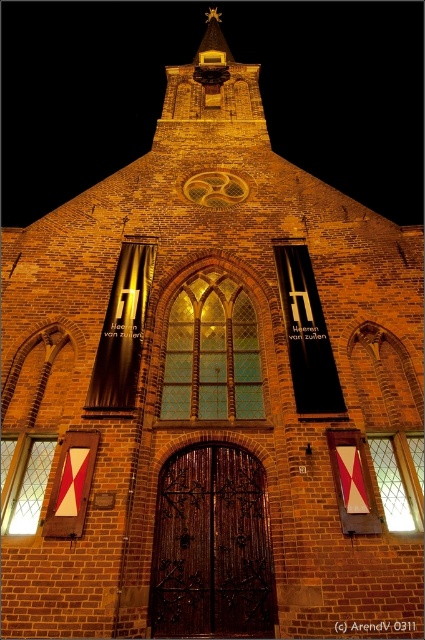
You are standing in front of the historic brick church at night. There is a dark brown wood at center located at point (212, 547). Can you tell me what is at that specific coordinate?

The dark brown wood at center is located at point (212, 547).

You are a delivery person who needs to place a 30 feet long ladder against the church wall. The ladder must be placed between the dark brown wood at center and the translucent glass window at center. Can the ladder fit in the space between them?

The distance between the dark brown wood at center and the translucent glass window at center is 36.95 feet, which is greater than the ladder length of 30 feet. Therefore, the ladder can fit between them.

You are an architect examining the church facade. You need to determine which of the two windows, the translucent glass window at center or the transparent glass window at lower right, has a greater width. Based on the scene, which one is wider?

The translucent glass window at center is wider than the transparent glass window at lower right according to the description.